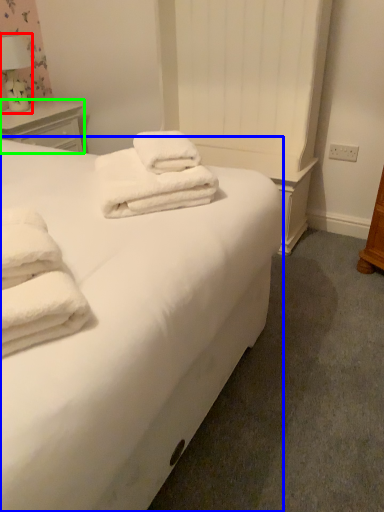
Question: Which object is the closest to the table lamp (highlighted by a red box)? Choose among these: bed (highlighted by a blue box) or nightstand (highlighted by a green box).

Choices:
 (A) bed
 (B) nightstand

Answer: (B)